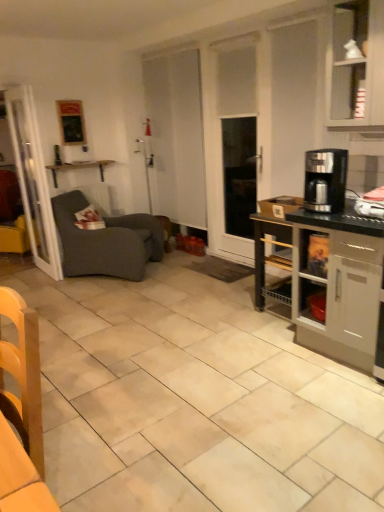
Question: Does satin black coffee maker at right contain wooden shelf at upper left?

Choices:
 (A) yes
 (B) no

Answer: (B)

Question: Is satin black coffee maker at right aimed at wooden shelf at upper left?

Choices:
 (A) yes
 (B) no

Answer: (B)

Question: Does satin black coffee maker at right come behind wooden shelf at upper left?

Choices:
 (A) yes
 (B) no

Answer: (B)

Question: Is satin black coffee maker at right to the right of wooden shelf at upper left from the viewer's perspective?

Choices:
 (A) no
 (B) yes

Answer: (B)

Question: From the image's perspective, does satin black coffee maker at right appear lower than wooden shelf at upper left?

Choices:
 (A) no
 (B) yes

Answer: (B)

Question: In terms of size, does wooden shelf at upper left appear bigger or smaller than wooden chair at lower left?

Choices:
 (A) small
 (B) big

Answer: (A)

Question: Considering the positions of point (72, 164) and point (39, 410), is point (72, 164) closer or farther from the camera than point (39, 410)?

Choices:
 (A) closer
 (B) farther

Answer: (B)

Question: Considering their positions, is wooden shelf at upper left located in front of or behind wooden chair at lower left?

Choices:
 (A) front
 (B) behind

Answer: (B)

Question: Is wooden shelf at upper left spatially inside wooden chair at lower left, or outside of it?

Choices:
 (A) inside
 (B) outside

Answer: (B)

Question: From a real-world perspective, is black glossy coffee maker at right above or below satin black coffee maker at right?

Choices:
 (A) above
 (B) below

Answer: (B)

Question: Is point (291, 219) positioned closer to the camera than point (337, 183)?

Choices:
 (A) closer
 (B) farther

Answer: (B)

Question: Is black glossy coffee maker at right wider or thinner than satin black coffee maker at right?

Choices:
 (A) thin
 (B) wide

Answer: (B)

Question: Is black glossy coffee maker at right taller or shorter than satin black coffee maker at right?

Choices:
 (A) tall
 (B) short

Answer: (A)

Question: Considering the relative positions of wooden chair at lower left and white glossy cabinet at upper right in the image provided, is wooden chair at lower left to the left or to the right of white glossy cabinet at upper right?

Choices:
 (A) left
 (B) right

Answer: (A)

Question: Is wooden chair at lower left spatially inside white glossy cabinet at upper right, or outside of it?

Choices:
 (A) outside
 (B) inside

Answer: (A)